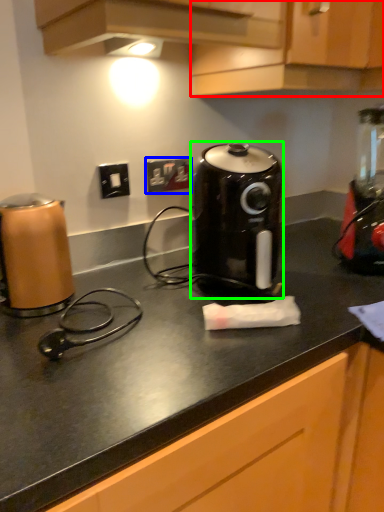
Question: Which object is positioned farthest from cabinetry (highlighted by a red box)? Select from electric outlet (highlighted by a blue box) and kitchen appliance (highlighted by a green box).

Choices:
 (A) electric outlet
 (B) kitchen appliance

Answer: (A)